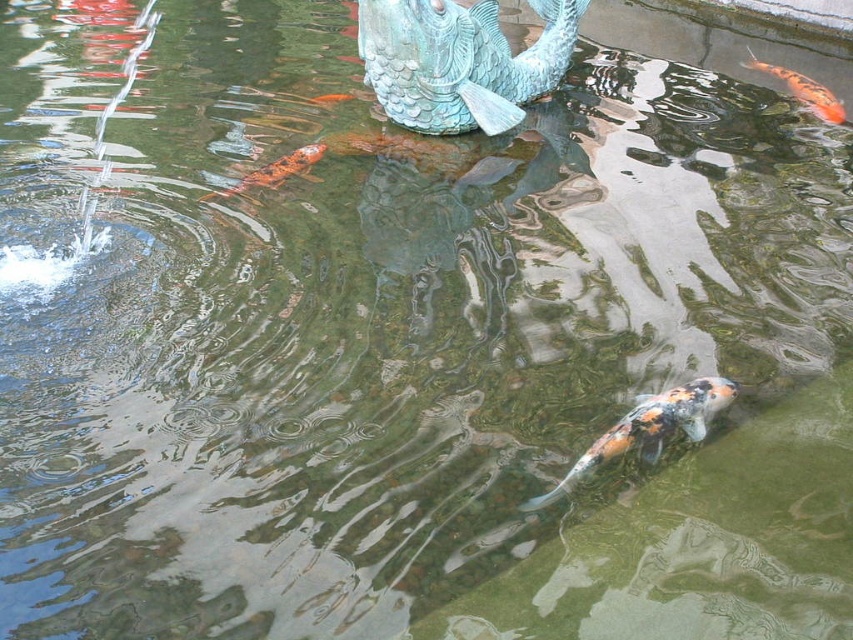
Looking at this image, you are a photographer trying to capture a photo of the orange shiny fish at upper right and the shiny orange fish at center. Since you want both in the frame, which direction should you move your camera to ensure both fish are visible?

The orange shiny fish at upper right is to the right of the shiny orange fish at center, so you should move your camera to the left to ensure both fish are visible.

You are a photographer trying to capture the speckled orange and white fish at center and the shiny orange fish at center in a single shot. Which fish will appear larger in your photo?

The speckled orange and white fish at center will appear larger in the photo because it is closer to the viewer than the shiny orange fish at center.

In the scene shown: You are a photographer trying to capture the height difference between the orange shiny fish at upper right and the shiny orange fish at center. Which fish appears taller in the image?

The orange shiny fish at upper right appears much taller than the shiny orange fish at center.